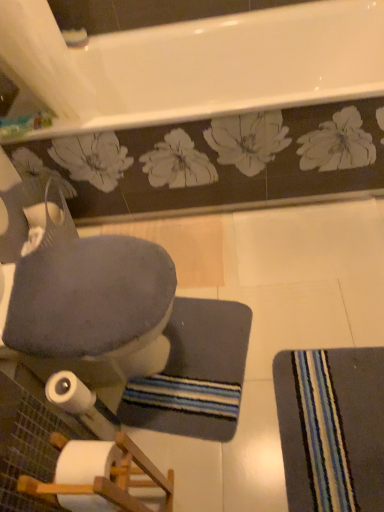
Where is `free point above dark gray textured bath mat at center (from a real-world perspective)`? The image size is (384, 512). free point above dark gray textured bath mat at center (from a real-world perspective) is located at coordinates (201, 361).